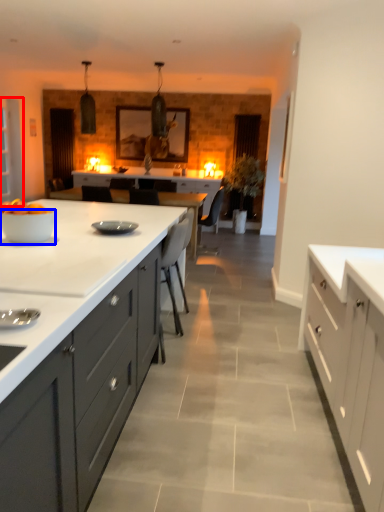
Question: Among these objects, which one is nearest to the camera, glass door (highlighted by a red box) or bowl (highlighted by a blue box)?

Choices:
 (A) glass door
 (B) bowl

Answer: (B)